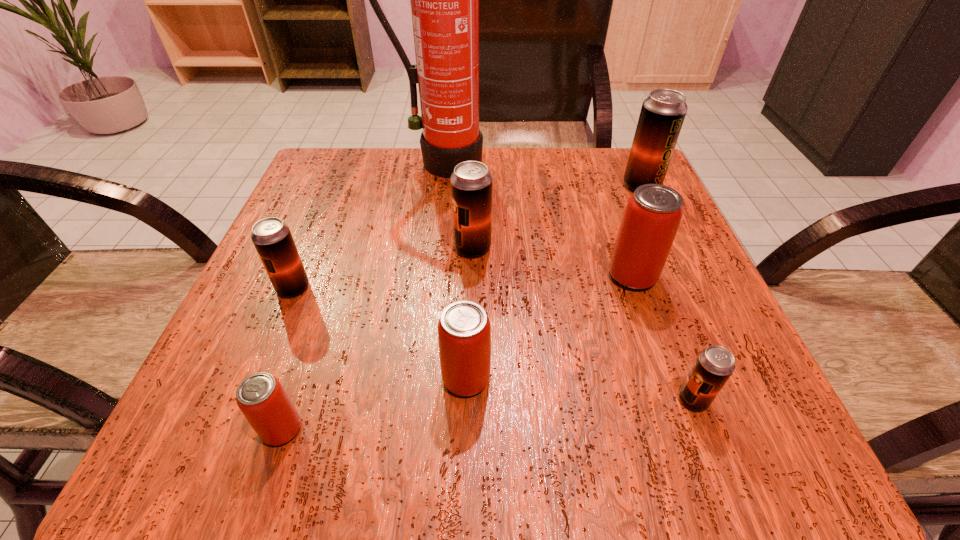
Locate an element on the screen. The width and height of the screenshot is (960, 540). vacant space that satisfies the following two spatial constraints: 1. on the back side of the third nearest black beer can; 2. on the right side of the smallest pink beer can is located at coordinates (343, 248).

At what (x,y) coordinates should I click in order to perform the action: click on vacant area that satisfies the following two spatial constraints: 1. on the front-facing side of the nearest black beer can; 2. on the left side of the fire extinguisher. Please return your answer as a coordinate pair (x, y). Image resolution: width=960 pixels, height=540 pixels. Looking at the image, I should click on (414, 399).

Image resolution: width=960 pixels, height=540 pixels. Identify the location of free location that satisfies the following two spatial constraints: 1. on the back side of the nearest black beer can; 2. on the right side of the nearest pink beer can. (292, 399).

Where is `free spot that satisfies the following two spatial constraints: 1. on the front-facing side of the seventh shortest object; 2. on the left side of the tallest object`? free spot that satisfies the following two spatial constraints: 1. on the front-facing side of the seventh shortest object; 2. on the left side of the tallest object is located at coordinates (439, 186).